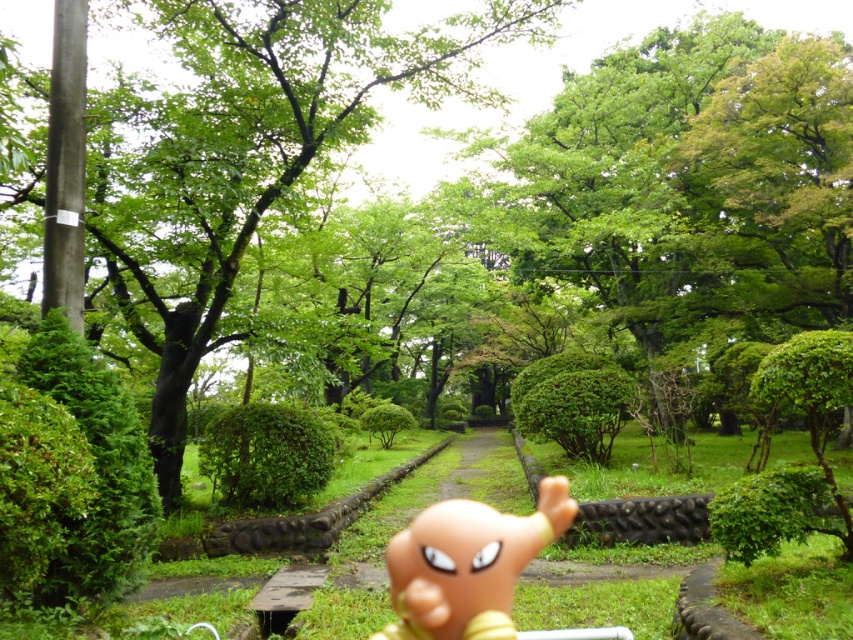
What do you see at coordinates (248, 154) in the screenshot? I see `green leafy tree at center` at bounding box center [248, 154].

Is point (345, 38) positioned before point (515, 545)?

That is False.

Identify the location of green leafy tree at center. point(248,154).